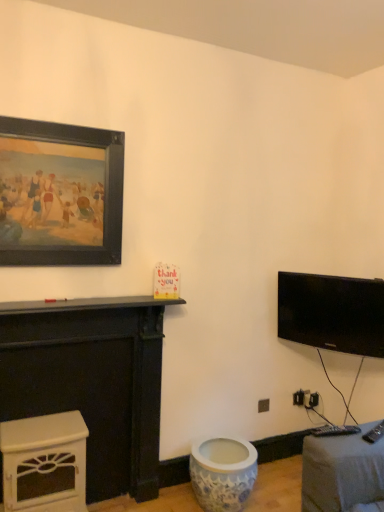
Question: From a real-world perspective, is blue porcelain vase at lower center above or below black matte picture frame at upper left?

Choices:
 (A) above
 (B) below

Answer: (B)

Question: Would you say blue porcelain vase at lower center is to the left or to the right of black matte picture frame at upper left in the picture?

Choices:
 (A) right
 (B) left

Answer: (A)

Question: Which of these objects is positioned farthest from the white painted wood fireplace at left, the 2th furniture ordered from the bottom?

Choices:
 (A) black matte picture frame at upper left
 (B) white glossy fireplace at lower left, which is counted as the 2th furniture, starting from the top
 (C) blue porcelain vase at lower center
 (D) black glossy tv at upper right

Answer: (D)

Question: Which object is the farthest from the blue porcelain vase at lower center?

Choices:
 (A) black glossy tv at upper right
 (B) white painted wood fireplace at left, the 2th furniture ordered from the bottom
 (C) black matte picture frame at upper left
 (D) white glossy fireplace at lower left, which is counted as the 2th furniture, starting from the top

Answer: (C)